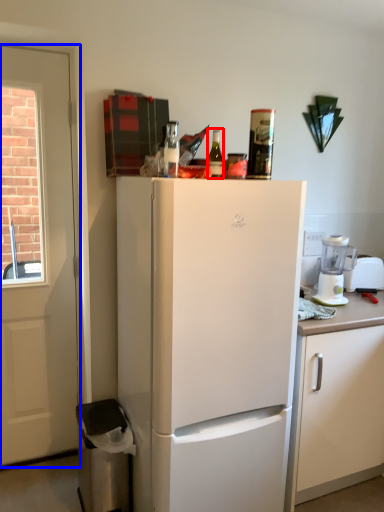
Question: Which point is closer to the camera, bottle (highlighted by a red box) or door (highlighted by a blue box)?

Choices:
 (A) bottle
 (B) door

Answer: (A)